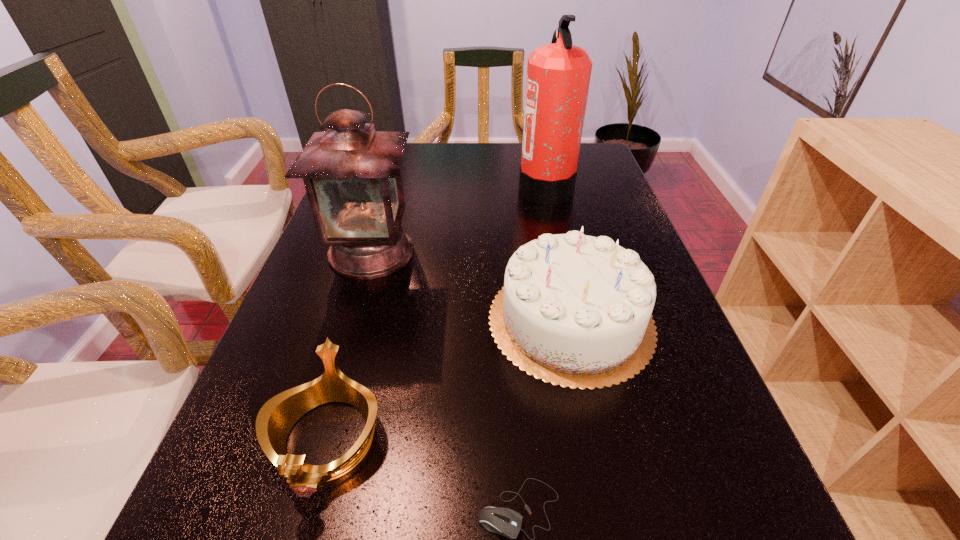
Find the location of `the farthest object`. the farthest object is located at coordinates (558, 74).

You are a GUI agent. You are given a task and a screenshot of the screen. Output one action in this format:
    pyautogui.click(x=<x>, y=<y>)
    Task: Click on the tallest object
    Image resolution: width=960 pixels, height=540 pixels.
    Given the screenshot: What is the action you would take?
    pyautogui.click(x=558, y=74)

At what (x,y) coordinates should I click in order to perform the action: click on the fourth shortest object. Please return your answer as a coordinate pair (x, y). The image size is (960, 540). Looking at the image, I should click on (352, 175).

At what (x,y) coordinates should I click in order to perform the action: click on birthday cake. Please return your answer as a coordinate pair (x, y). The image size is (960, 540). Looking at the image, I should click on (575, 310).

The height and width of the screenshot is (540, 960). Identify the location of the fourth tallest object. (278, 415).

The height and width of the screenshot is (540, 960). What are the coordinates of `free space located 0.080m on the front side of the fire extinguisher` in the screenshot? It's located at (492, 187).

In order to click on free space located on the front side of the fire extinguisher in this screenshot , I will do `click(485, 187)`.

Locate an element on the screen. vacant space situated on the front side of the fire extinguisher is located at coordinates (411, 187).

At what (x,y) coordinates should I click in order to perform the action: click on free location located 0.230m on the right of the fourth shortest object. Please return your answer as a coordinate pair (x, y). The image size is (960, 540). Looking at the image, I should click on (510, 252).

This screenshot has height=540, width=960. What are the coordinates of `free location located 0.150m on the left of the birthday cake` in the screenshot? It's located at (415, 320).